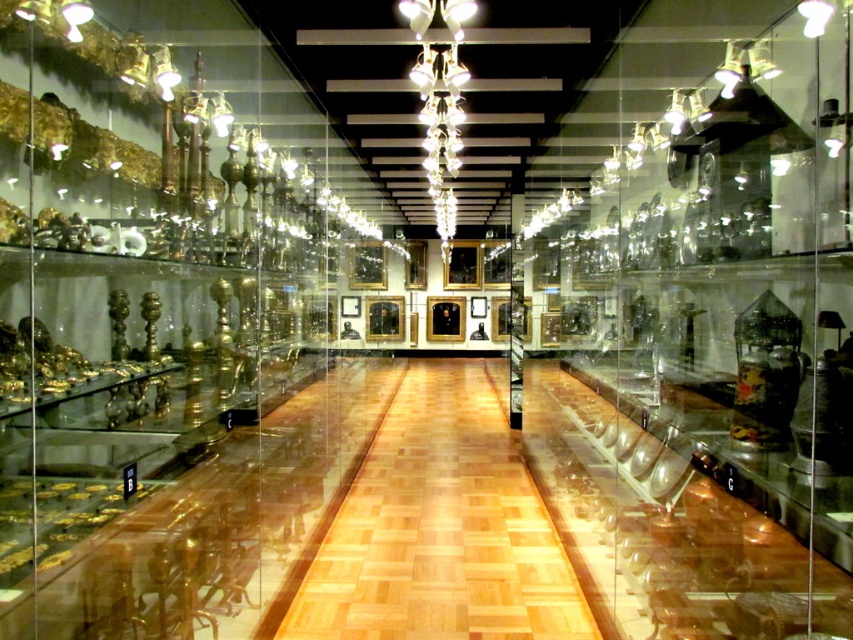
Question: Is clear glass display case at center in front of white glass chandelier at center?

Choices:
 (A) yes
 (B) no

Answer: (A)

Question: Among these objects, which one is farthest from the camera?

Choices:
 (A) clear glass display case at center
 (B) white glass chandelier at center

Answer: (B)

Question: Which of the following is the farthest from the observer?

Choices:
 (A) (675, 218)
 (B) (447, 209)

Answer: (B)

Question: Is clear glass display case at center positioned behind white glass chandelier at center?

Choices:
 (A) yes
 (B) no

Answer: (B)

Question: Is clear glass display case at center wider than white glass chandelier at center?

Choices:
 (A) yes
 (B) no

Answer: (A)